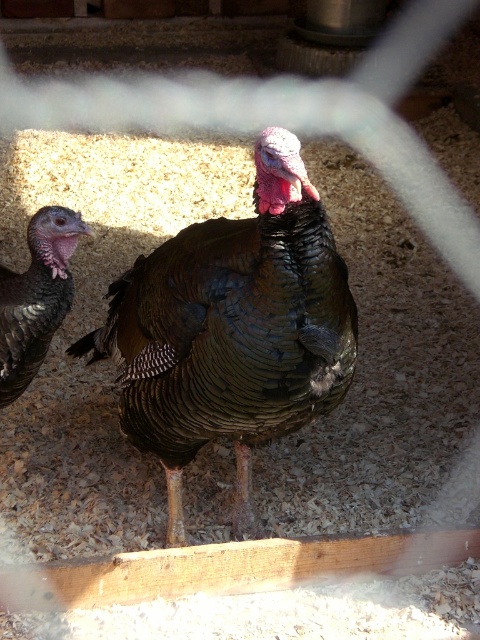
You are a farmer standing at the edge of the barn and want to feed the shiny dark brown turkey at center. If your reach is 1.5 meters, can you feed it without moving closer?

The shiny dark brown turkey at center is 1.62 meters away from camera, so you cannot reach it with your 1.5 meter reach. You need to move closer to feed it.

You are a farmer checking the turkeys in your barn. You notice two turkeys, the shiny dark brown turkey at center and the shiny brown turkey at left. Which turkey do you think is bigger?

The shiny dark brown turkey at center is larger in size than the shiny brown turkey at left, so the shiny dark brown turkey at center is bigger.

You are standing in the barn and want to place a small treat for the turkeys. You have two points marked as potential spots. The first point is at coordinate point (287, 216) and the second is at point (48, 346). Which point is closer to you where you are standing?

Point (287, 216) is closer to the camera than point (48, 346), so the first point is closer to you.